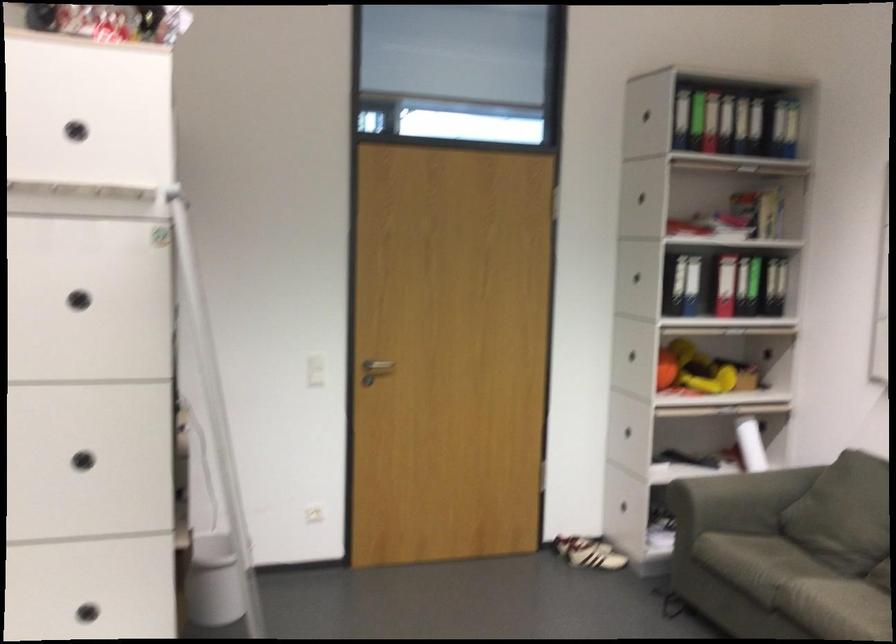
Where would you lift the white and red shoe? Please return your answer as a coordinate pair (x, y).

(583, 552)